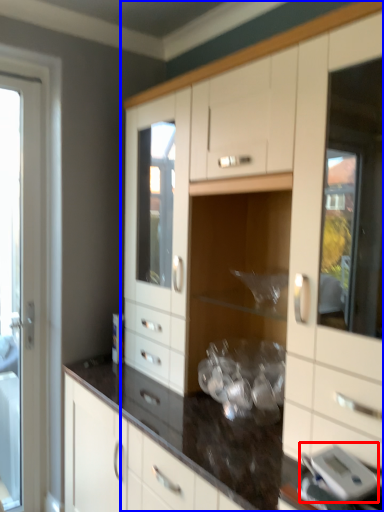
Question: Which object appears farthest to the camera in this image, appliance (highlighted by a red box) or cabinetry (highlighted by a blue box)?

Choices:
 (A) appliance
 (B) cabinetry

Answer: (A)